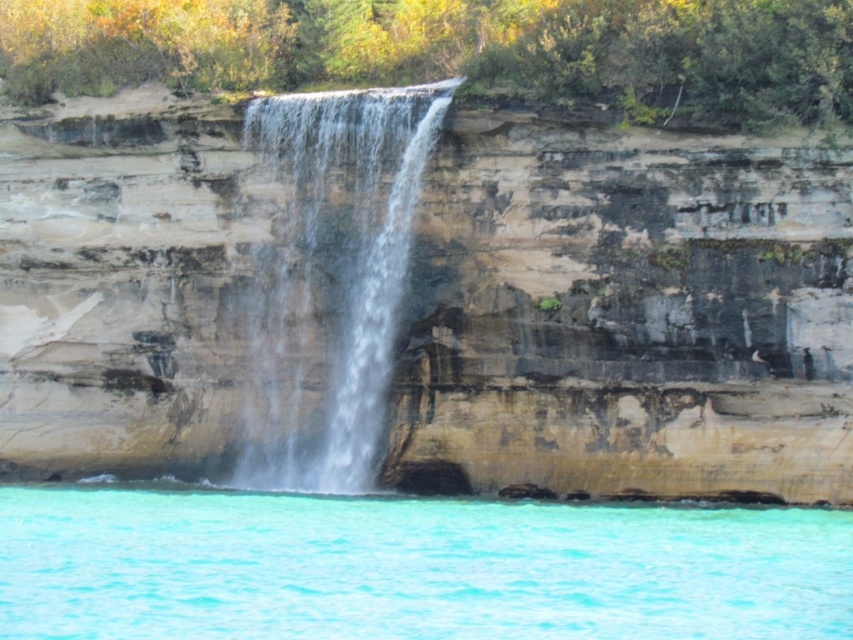
Question: Which point is farther to the camera?

Choices:
 (A) turquoise liquid at lower center
 (B) brown/rocky cliff face at center

Answer: (B)

Question: Estimate the real-world distances between objects in this image. Which object is farther from the turquoise liquid at lower center?

Choices:
 (A) clear water at center
 (B) brown/rocky cliff face at center

Answer: (A)

Question: Which point is closer to the camera taking this photo?

Choices:
 (A) (311, 237)
 (B) (666, 285)

Answer: (B)

Question: Does turquoise liquid at lower center have a lesser width compared to clear water at center?

Choices:
 (A) yes
 (B) no

Answer: (B)

Question: From the image, what is the correct spatial relationship of brown/rocky cliff face at center in relation to turquoise liquid at lower center?

Choices:
 (A) right
 (B) left

Answer: (A)

Question: Is turquoise liquid at lower center thinner than clear water at center?

Choices:
 (A) yes
 (B) no

Answer: (B)